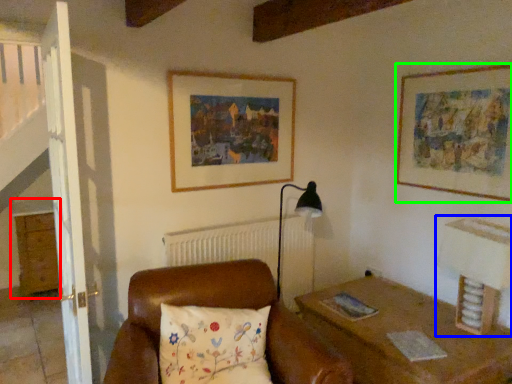
Question: Which object is the farthest from dresser (highlighted by a red box)? Choose among these: table lamp (highlighted by a blue box) or picture frame (highlighted by a green box).

Choices:
 (A) table lamp
 (B) picture frame

Answer: (A)